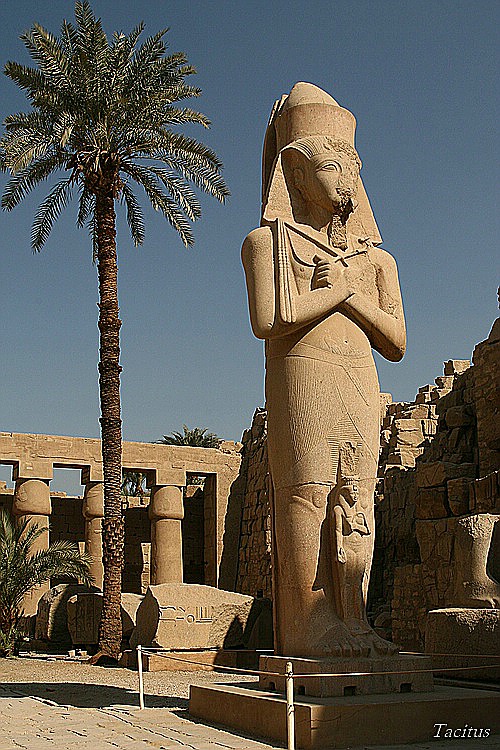
Identify the location of pillars. (19, 517), (88, 520), (154, 544).